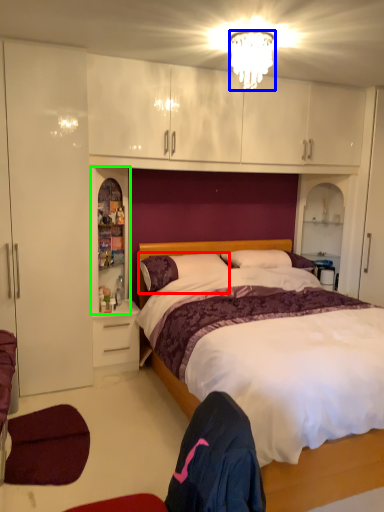
Question: Considering the real-world distances, which object is closest to pillow (highlighted by a red box)? lamp (highlighted by a blue box) or cabinet (highlighted by a green box).

Choices:
 (A) lamp
 (B) cabinet

Answer: (B)